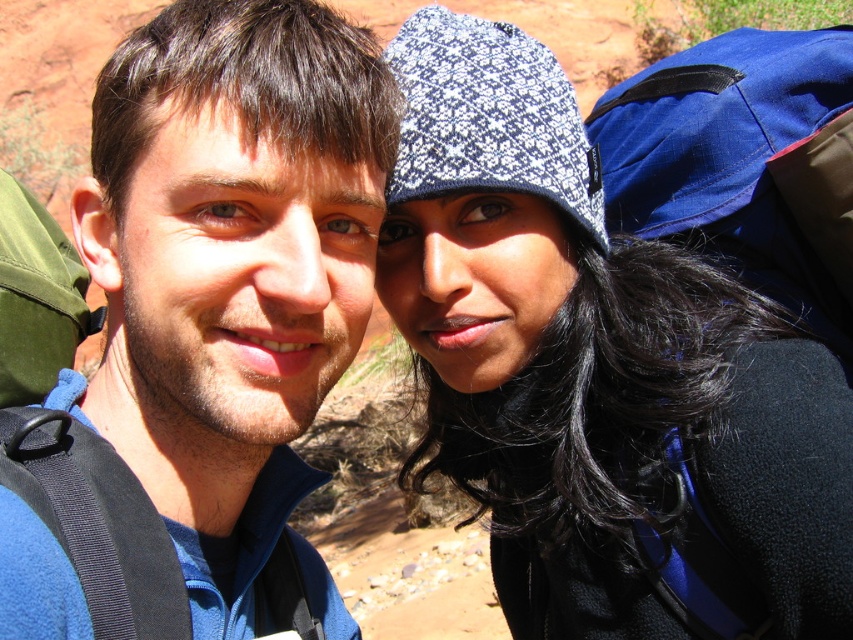
Is point (210, 627) positioned behind point (701, 60)?

No, (210, 627) is in front of (701, 60).

Where is `blue fleece jacket at left`? This screenshot has height=640, width=853. blue fleece jacket at left is located at coordinates (229, 266).

Find the location of `blue fleece jacket at left`. blue fleece jacket at left is located at coordinates (229, 266).